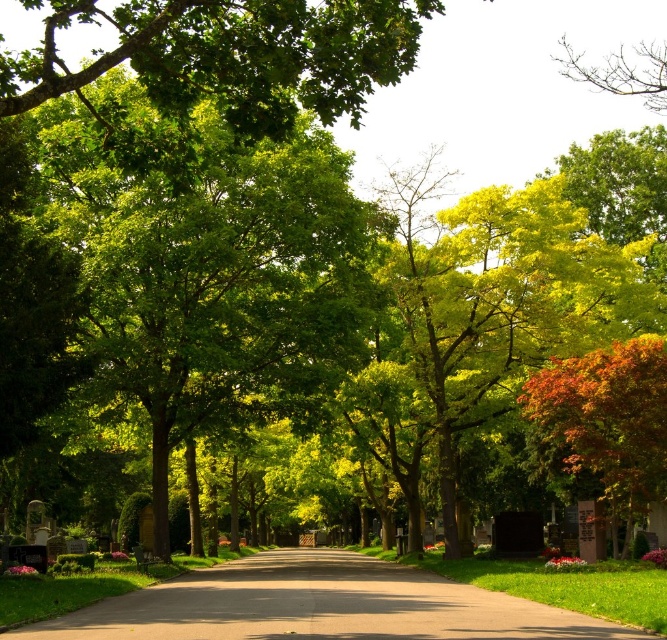
Question: Does green leafy tree at center lie in front of autumnal leaves at right?

Choices:
 (A) no
 (B) yes

Answer: (B)

Question: Estimate the real-world distances between objects in this image. Which object is closer to the autumnal leaves at right?

Choices:
 (A) smooth asphalt road at center
 (B) green leafy tree at center

Answer: (B)

Question: Which is nearer to the green leafy tree at center?

Choices:
 (A) autumnal leaves at right
 (B) smooth asphalt road at center

Answer: (B)

Question: Does smooth asphalt road at center appear over autumnal leaves at right?

Choices:
 (A) no
 (B) yes

Answer: (A)

Question: Among these objects, which one is farthest from the camera?

Choices:
 (A) green leafy tree at center
 (B) smooth asphalt road at center
 (C) autumnal leaves at right

Answer: (C)

Question: Is the position of green leafy tree at center more distant than that of smooth asphalt road at center?

Choices:
 (A) no
 (B) yes

Answer: (B)